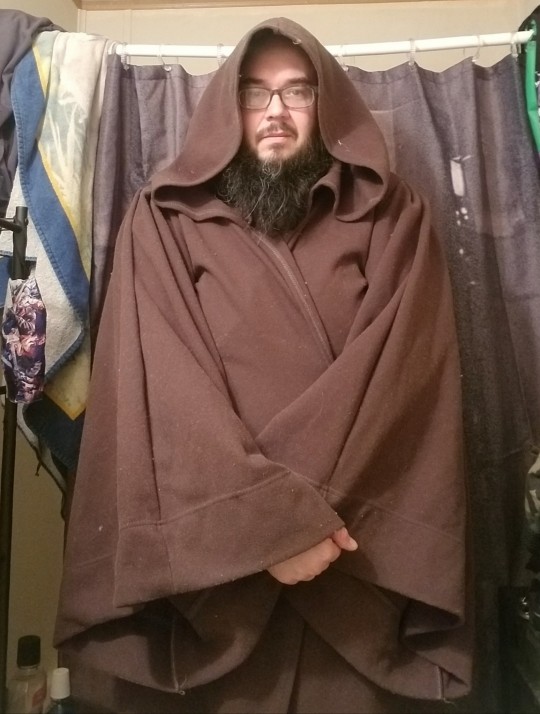
The image size is (540, 714). Find the location of `hood`. hood is located at coordinates (337, 105).